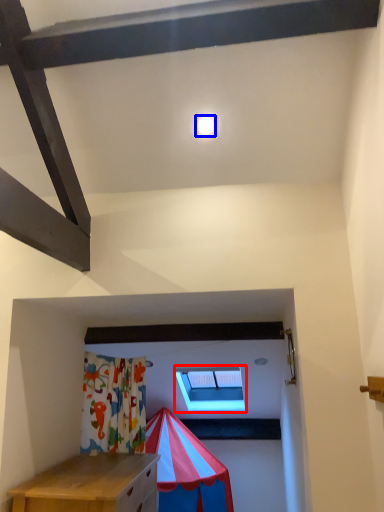
Question: Which of the following is the farthest to the observer, window (highlighted by a red box) or light (highlighted by a blue box)?

Choices:
 (A) window
 (B) light

Answer: (A)